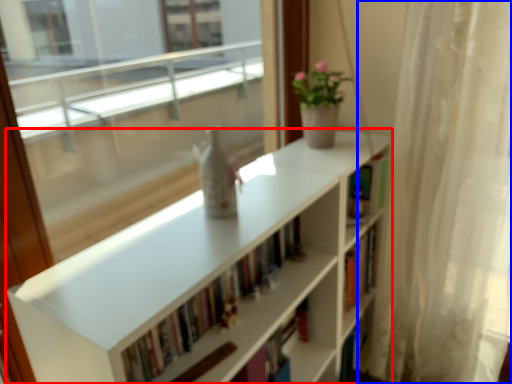
Question: Which of the following is the farthest to the observer, bookcase (highlighted by a red box) or curtain (highlighted by a blue box)?

Choices:
 (A) bookcase
 (B) curtain

Answer: (B)